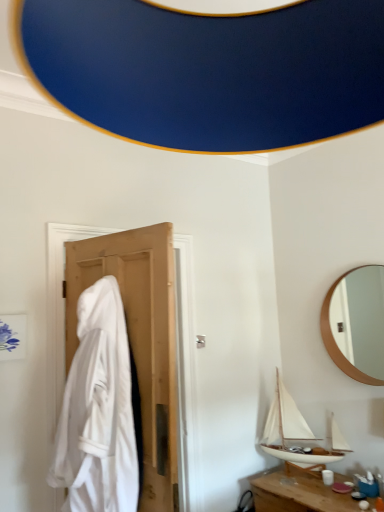
I want to click on free space in front of white wood boat at lower right, so click(x=314, y=497).